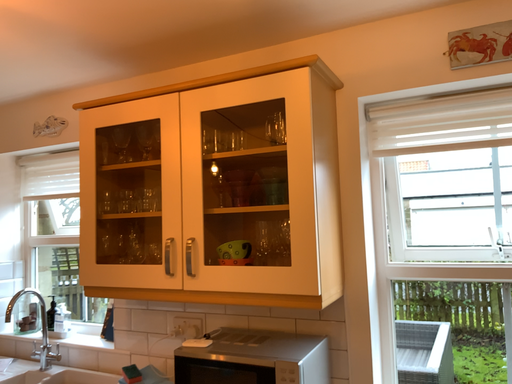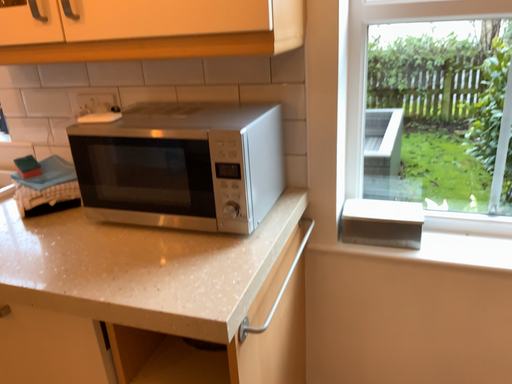
Question: How did the camera likely rotate when shooting the video?

Choices:
 (A) rotated right
 (B) rotated left

Answer: (A)